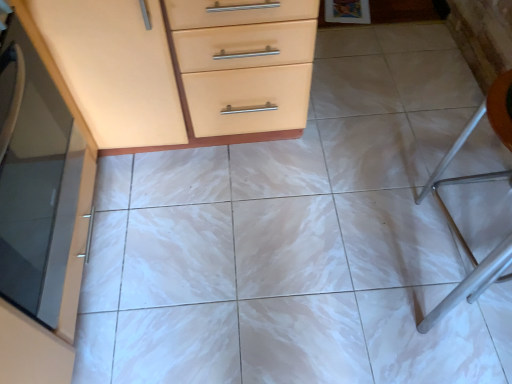
The height and width of the screenshot is (384, 512). In order to click on vacant area located to the right-hand side of matte orange cabinet at upper left, placed as the 1th chest of drawers when sorted from top to bottom in this screenshot , I will do `click(385, 139)`.